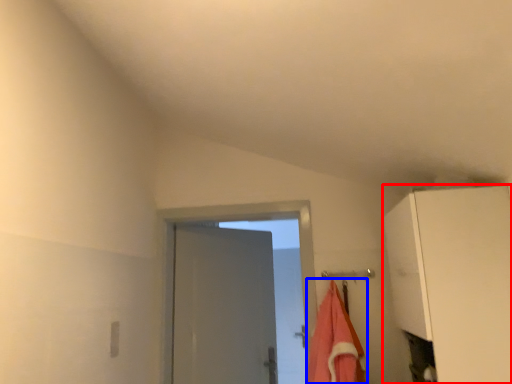
Question: Which object appears closest to the camera in this image, cabinetry (highlighted by a red box) or beach towel (highlighted by a blue box)?

Choices:
 (A) cabinetry
 (B) beach towel

Answer: (A)